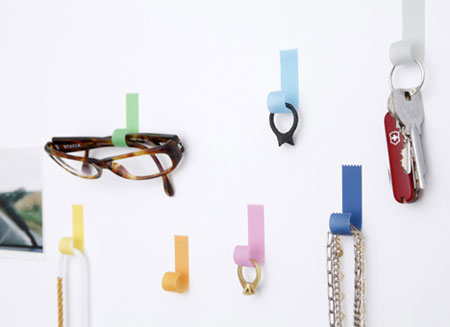
You are a GUI agent. You are given a task and a screenshot of the screen. Output one action in this format:
    pyautogui.click(x=<x>, y=<y>)
    Task: Click on the keys
    
    Given the screenshot: What is the action you would take?
    pyautogui.click(x=405, y=118)